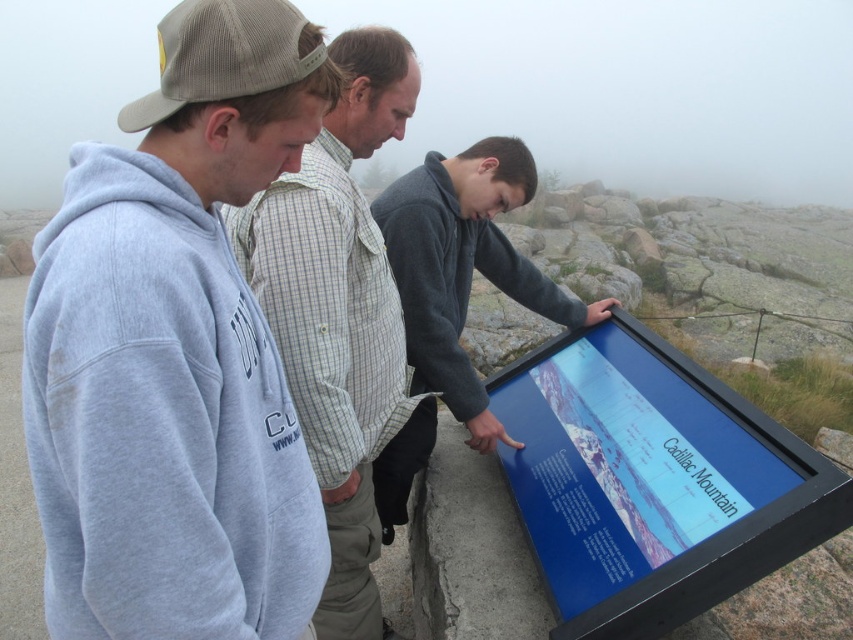
Question: In this image, where is blue glossy tablet at center located relative to light gray sweatshirt at center?

Choices:
 (A) right
 (B) left

Answer: (A)

Question: Which object appears closest to the camera in this image?

Choices:
 (A) light gray sweatshirt at center
 (B) blue glossy tablet at center

Answer: (A)

Question: Can you confirm if blue glossy tablet at center is smaller than light gray sweatshirt at center?

Choices:
 (A) yes
 (B) no

Answer: (A)

Question: Does blue glossy tablet at center have a smaller size compared to light gray sweatshirt at center?

Choices:
 (A) yes
 (B) no

Answer: (A)

Question: Among these points, which one is nearest to the camera?

Choices:
 (A) (612, 484)
 (B) (64, 422)
 (C) (314, 410)

Answer: (B)

Question: Among these objects, which one is nearest to the camera?

Choices:
 (A) blue glossy tablet at center
 (B) light gray hoodie at left

Answer: (B)